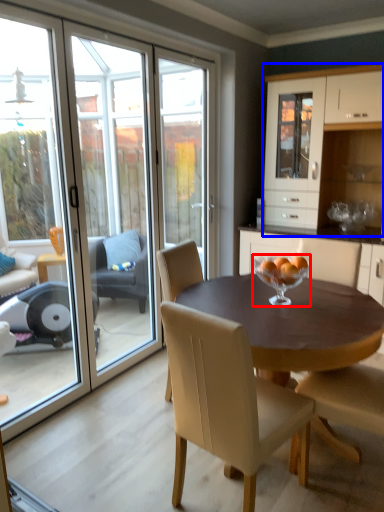
Question: Among these objects, which one is farthest to the camera, glass bowl (highlighted by a red box) or cabinetry (highlighted by a blue box)?

Choices:
 (A) glass bowl
 (B) cabinetry

Answer: (B)